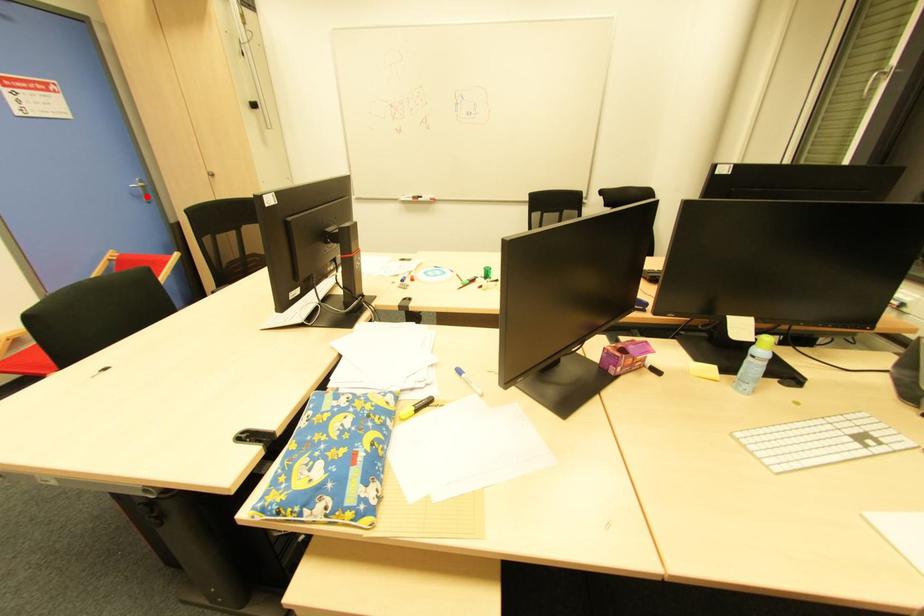
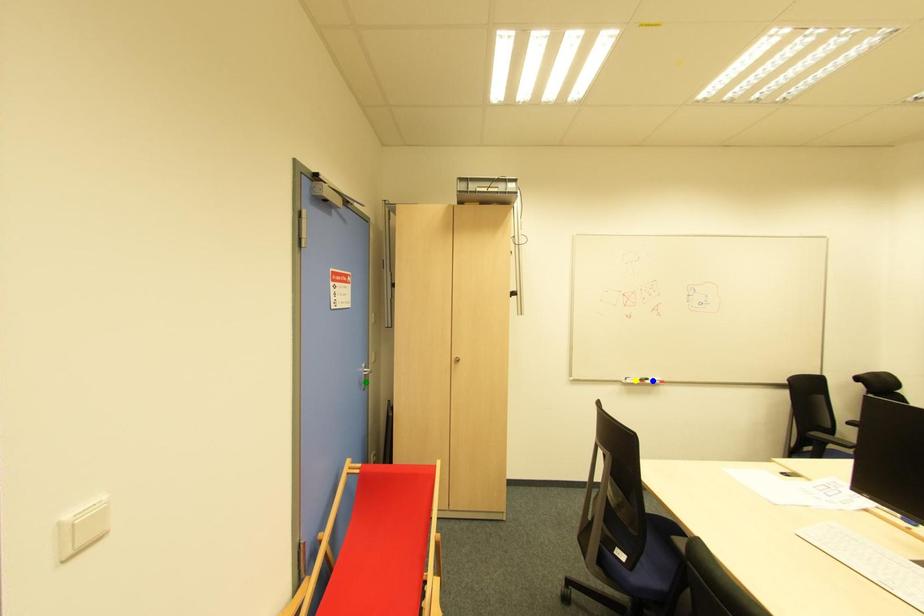
Question: I am providing you with two images of the same scene from different viewpoints. A red point is marked on the first image. You are given multiple points on the second image. Which spot in image 2 lines up with the point in image 1?

Choices:
 (A) green point
 (B) blue point
 (C) yellow point

Answer: (A)